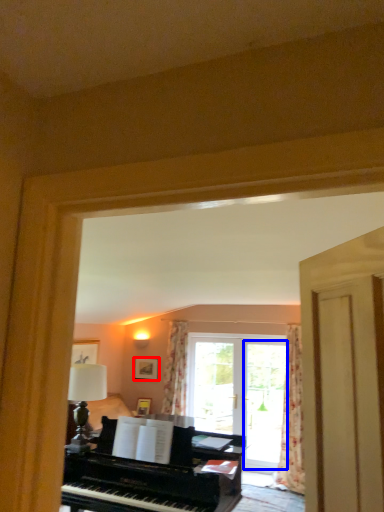
Question: Among these objects, which one is farthest to the camera, picture frame (highlighted by a red box) or screen door (highlighted by a blue box)?

Choices:
 (A) picture frame
 (B) screen door

Answer: (A)